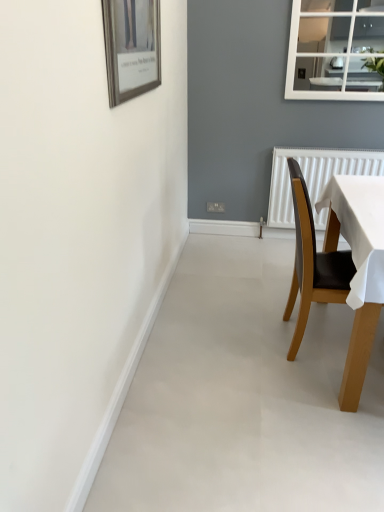
Question: From a real-world perspective, is brown wooden chair at right on wooden-framed picture at upper left?

Choices:
 (A) no
 (B) yes

Answer: (A)

Question: Can you confirm if brown wooden chair at right is bigger than wooden-framed picture at upper left?

Choices:
 (A) no
 (B) yes

Answer: (B)

Question: From a real-world perspective, is brown wooden chair at right below wooden-framed picture at upper left?

Choices:
 (A) no
 (B) yes

Answer: (B)

Question: Is brown wooden chair at right facing towards wooden-framed picture at upper left?

Choices:
 (A) no
 (B) yes

Answer: (A)

Question: Can wooden-framed picture at upper left be found inside brown wooden chair at right?

Choices:
 (A) yes
 (B) no

Answer: (B)

Question: Considering the relative sizes of brown wooden chair at right and wooden-framed picture at upper left in the image provided, is brown wooden chair at right wider than wooden-framed picture at upper left?

Choices:
 (A) no
 (B) yes

Answer: (B)

Question: Considering the relative sizes of wooden-framed picture at upper left and brown wooden chair at right in the image provided, is wooden-framed picture at upper left thinner than brown wooden chair at right?

Choices:
 (A) no
 (B) yes

Answer: (B)

Question: Are wooden-framed picture at upper left and brown wooden chair at right far apart?

Choices:
 (A) yes
 (B) no

Answer: (B)

Question: Does wooden-framed picture at upper left have a smaller size compared to brown wooden chair at right?

Choices:
 (A) no
 (B) yes

Answer: (B)

Question: Can you confirm if wooden-framed picture at upper left is bigger than brown wooden chair at right?

Choices:
 (A) yes
 (B) no

Answer: (B)

Question: Is wooden-framed picture at upper left at the left side of brown wooden chair at right?

Choices:
 (A) yes
 (B) no

Answer: (A)

Question: Is wooden-framed picture at upper left aimed at brown wooden chair at right?

Choices:
 (A) no
 (B) yes

Answer: (A)

Question: Would you say brown wooden chair at right is to the left or to the right of wooden-framed picture at upper left in the picture?

Choices:
 (A) left
 (B) right

Answer: (B)